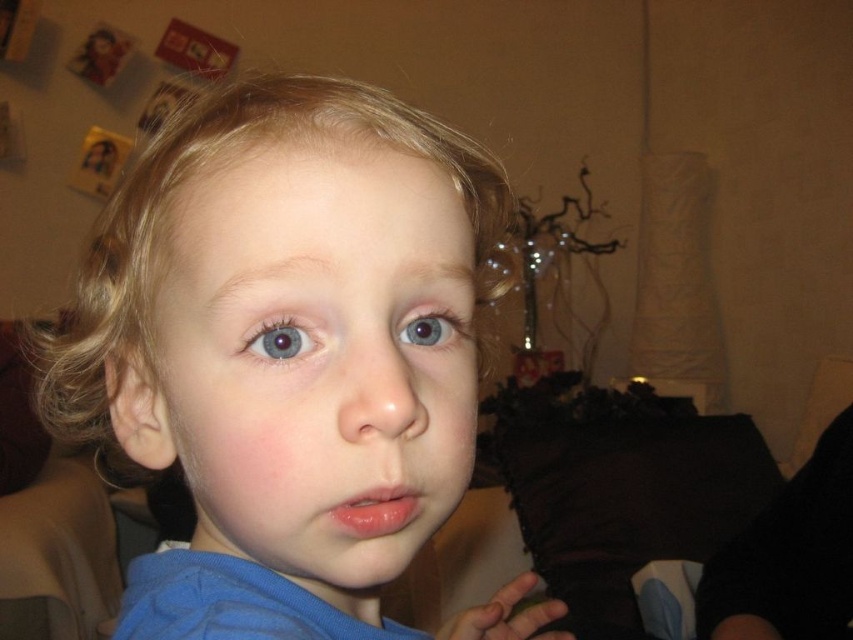
Between blue fabric shirt at center and blue glossy eye at center, which one appears on the right side from the viewer's perspective?

Positioned to the right is blue glossy eye at center.

Is point (352, 321) closer to camera compared to point (412, 316)?

Yes, point (352, 321) is in front of point (412, 316).

Identify the location of blue fabric shirt at center. The image size is (853, 640). (x=286, y=358).

Who is shorter, blue matte eye at center or blue glossy eye at center?

With less height is blue matte eye at center.

Does point (265, 346) lie behind point (418, 324)?

That is False.

Between point (265, 336) and point (408, 340), which one is positioned behind?

The point (408, 340) is more distant.

Where is `blue matte eye at center`? This screenshot has width=853, height=640. blue matte eye at center is located at coordinates (281, 339).

Is blue fabric shirt at center positioned before blue matte eye at center?

Yes.

You are a GUI agent. You are given a task and a screenshot of the screen. Output one action in this format:
    pyautogui.click(x=<x>, y=<y>)
    Task: Click on the blue fabric shirt at center
    Image resolution: width=853 pixels, height=640 pixels.
    Given the screenshot: What is the action you would take?
    pyautogui.click(x=286, y=358)